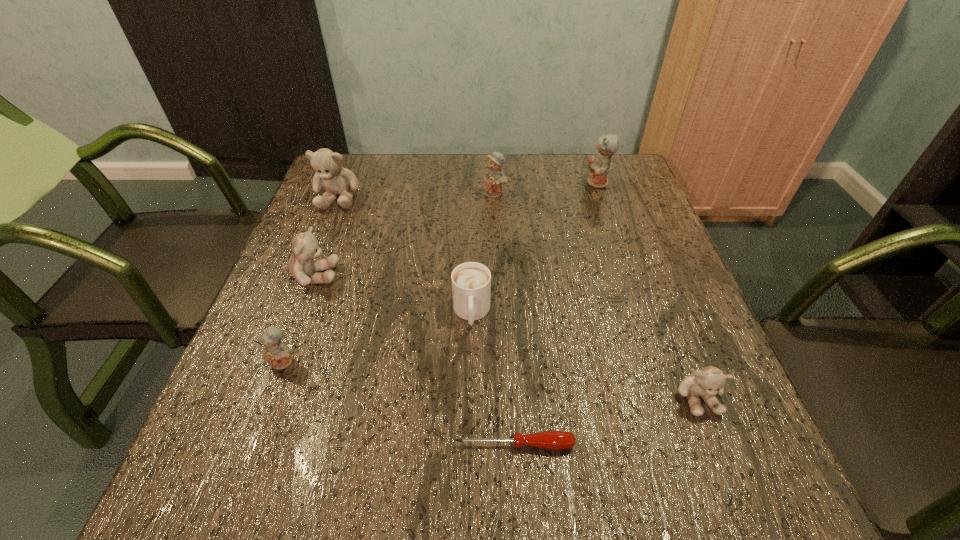
This screenshot has width=960, height=540. In the image, there is a desktop. Find the location of `free space at the right edge`. free space at the right edge is located at coordinates (644, 240).

Where is `free space at the far left corner of the desktop`? free space at the far left corner of the desktop is located at coordinates (381, 156).

Locate an element on the screen. free space at the near left corner is located at coordinates (202, 465).

Where is `vacant area at the far right corner`? Image resolution: width=960 pixels, height=540 pixels. vacant area at the far right corner is located at coordinates (610, 172).

Image resolution: width=960 pixels, height=540 pixels. In order to click on vacant space that's between the farthest gray teddy bear and the biggest blue teddy bear in this screenshot , I will do `click(468, 190)`.

At what (x,y) coordinates should I click in order to perform the action: click on free space between the white cappuccino and the leftmost blue teddy bear. Please return your answer as a coordinate pair (x, y). Image resolution: width=960 pixels, height=540 pixels. Looking at the image, I should click on (377, 338).

What are the coordinates of `free space between the biggest blue teddy bear and the second smallest blue teddy bear` in the screenshot? It's located at (546, 188).

The height and width of the screenshot is (540, 960). Find the location of `blank region between the screwdriver and the nearest teddy bear`. blank region between the screwdriver and the nearest teddy bear is located at coordinates (606, 420).

This screenshot has width=960, height=540. I want to click on free space between the screwdriver and the fourth teddy bear from left to right, so click(505, 319).

Where is `vacant space that is in between the cappuccino and the screwdriver`? The image size is (960, 540). vacant space that is in between the cappuccino and the screwdriver is located at coordinates (493, 379).